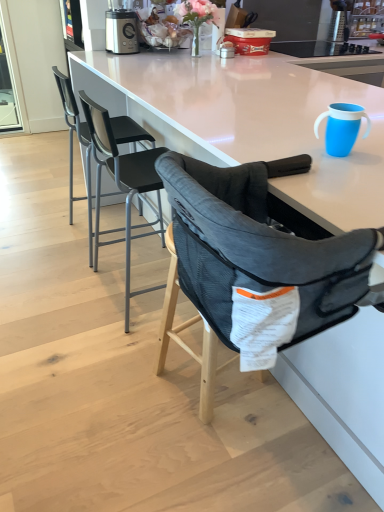
Image resolution: width=384 pixels, height=512 pixels. I want to click on free location to the right of mesh fabric high chair at center, so click(283, 412).